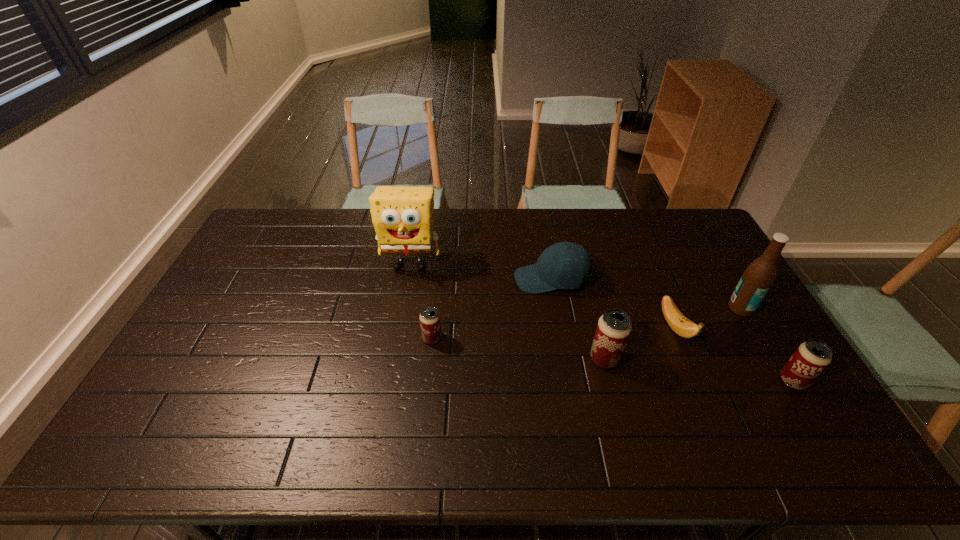
Locate an element on the screen. vacant space that satisfies the following two spatial constraints: 1. on the front-facing side of the baseball cap; 2. on the right side of the third object from right to left is located at coordinates (560, 327).

The image size is (960, 540). What are the coordinates of `vacant region that satisfies the following two spatial constraints: 1. on the front-facing side of the baseball cap; 2. on the back side of the second shortest beer can` in the screenshot? It's located at (568, 381).

Where is `blank space that satisfies the following two spatial constraints: 1. on the face of the sponge; 2. on the right side of the third object from right to left`? The width and height of the screenshot is (960, 540). blank space that satisfies the following two spatial constraints: 1. on the face of the sponge; 2. on the right side of the third object from right to left is located at coordinates (399, 327).

Identify the location of vacant space that satisfies the following two spatial constraints: 1. on the face of the sponge; 2. on the left side of the leftmost beer can. The height and width of the screenshot is (540, 960). (397, 339).

Image resolution: width=960 pixels, height=540 pixels. I want to click on vacant area that satisfies the following two spatial constraints: 1. on the face of the shortest beer can; 2. on the left side of the sponge, so click(x=397, y=339).

The image size is (960, 540). Identify the location of free space in the image that satisfies the following two spatial constraints: 1. on the face of the shortest beer can; 2. on the right side of the sponge. (x=397, y=339).

Find the location of a particular element. Image resolution: width=960 pixels, height=540 pixels. blank space that satisfies the following two spatial constraints: 1. on the back side of the banana; 2. on the left side of the farthest beer can is located at coordinates click(x=433, y=327).

You are a GUI agent. You are given a task and a screenshot of the screen. Output one action in this format:
    pyautogui.click(x=<x>, y=<y>)
    Task: Click on the vacant space that satisfies the following two spatial constraints: 1. on the front-facing side of the baseball cap; 2. on the left side of the banana
    
    Given the screenshot: What is the action you would take?
    pyautogui.click(x=560, y=327)

In order to click on blank space that satisfies the following two spatial constraints: 1. on the front-facing side of the fifth object from left to right; 2. on the right side of the baseball cap in this screenshot , I will do `click(560, 327)`.

The image size is (960, 540). I want to click on free location that satisfies the following two spatial constraints: 1. on the back side of the tallest beer can; 2. on the right side of the beer bottle, so click(x=592, y=308).